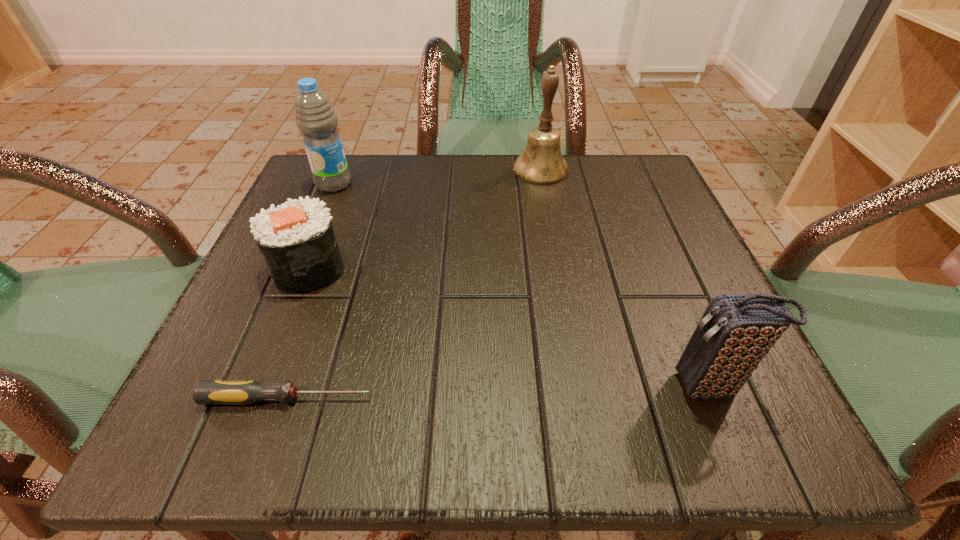
At what (x,y) coordinates should I click in order to perform the action: click on the second object from right to left. Please return your answer as a coordinate pair (x, y). The width and height of the screenshot is (960, 540). Looking at the image, I should click on (541, 163).

Where is `water bottle`? This screenshot has height=540, width=960. water bottle is located at coordinates (315, 117).

This screenshot has height=540, width=960. Identify the location of the third tallest object. (735, 333).

At what (x,y) coordinates should I click in order to perform the action: click on clutch bag. Please return your answer as a coordinate pair (x, y). Looking at the image, I should click on coord(735,333).

Find the location of `the third farthest object`. the third farthest object is located at coordinates (296, 239).

Image resolution: width=960 pixels, height=540 pixels. Find the location of `sushi`. sushi is located at coordinates (296, 239).

The height and width of the screenshot is (540, 960). What are the coordinates of `screwdriver` in the screenshot? It's located at (241, 392).

Find the location of a particular element. Image resolution: width=960 pixels, height=540 pixels. vacant space located 0.050m on the left of the bell is located at coordinates point(490,170).

Locate an element on the screen. The width and height of the screenshot is (960, 540). vacant space located 0.360m on the right of the water bottle is located at coordinates (525, 184).

Where is `vacant space located with the zip open on the clutch bag`? vacant space located with the zip open on the clutch bag is located at coordinates (616, 386).